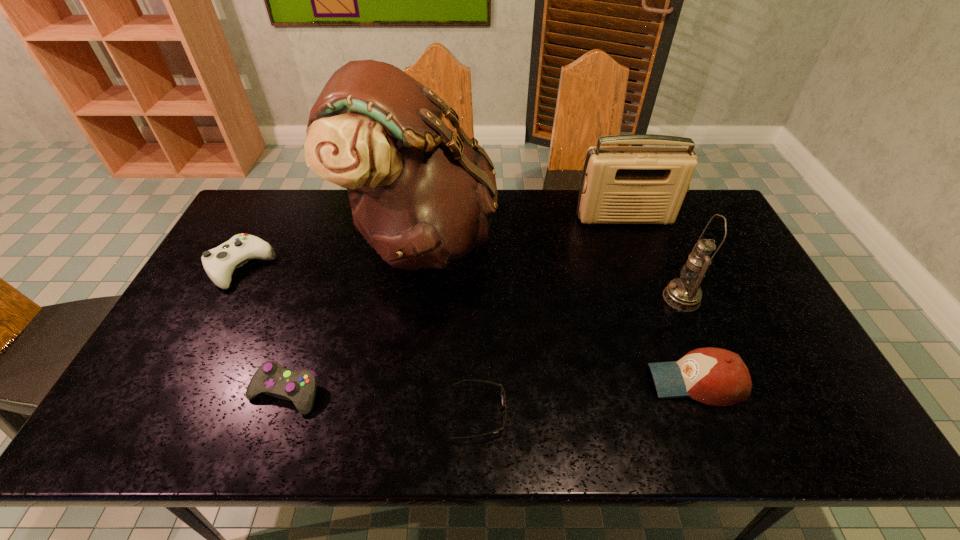
You are a GUI agent. You are given a task and a screenshot of the screen. Output one action in this format:
    pyautogui.click(x=<x>, y=<y>)
    Task: Click on the free space at the near right corner
    
    Given the screenshot: What is the action you would take?
    point(818,420)

The height and width of the screenshot is (540, 960). What are the coordinates of `empty space between the tallest object and the left control` in the screenshot? It's located at (332, 253).

The width and height of the screenshot is (960, 540). I want to click on vacant space in between the oil lamp and the nearer control, so click(483, 345).

Find the location of a particular element. The height and width of the screenshot is (540, 960). vacant region between the fourth tallest object and the sunglasses is located at coordinates (588, 397).

Identify the location of empty location between the nearer control and the radio receiver. The image size is (960, 540). (455, 305).

This screenshot has height=540, width=960. I want to click on vacant space in between the oil lamp and the shortest object, so click(x=580, y=355).

Locate an element on the screen. The width and height of the screenshot is (960, 540). free space between the oil lamp and the fourth shortest object is located at coordinates (688, 340).

Find the location of a particular element. The image size is (960, 540). free point between the oil lamp and the fourth tallest object is located at coordinates (688, 340).

Identify the location of vacant area that lies between the tallest object and the shortest object. The width and height of the screenshot is (960, 540). (450, 326).

At what (x,y) coordinates should I click in order to perform the action: click on unoccupied position between the baseball cap and the radio receiver. Please return your answer as a coordinate pair (x, y). The width and height of the screenshot is (960, 540). Looking at the image, I should click on (660, 300).